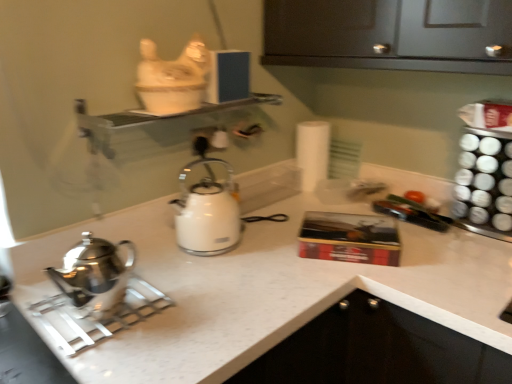
Question: Is clear glass shelf at upper center inside or outside of polished stainless steel kettle at left, acting as the first kettle starting from the left?

Choices:
 (A) outside
 (B) inside

Answer: (A)

Question: From their relative heights in the image, would you say clear glass shelf at upper center is taller or shorter than polished stainless steel kettle at left, the second kettle positioned from the back?

Choices:
 (A) short
 (B) tall

Answer: (A)

Question: Based on their relative distances, which object is farther from the white matte toilet paper at center?

Choices:
 (A) polished stainless steel kettle at left, acting as the first kettle starting from the left
 (B) clear glass shelf at upper center
 (C) white glossy kettle at center, the 1th kettle from the right

Answer: (A)

Question: Based on their relative distances, which object is nearer to the polished stainless steel kettle at left, acting as the first kettle starting from the left?

Choices:
 (A) white matte toilet paper at center
 (B) clear glass shelf at upper center
 (C) white glossy kettle at center, the 1th kettle from the right

Answer: (C)